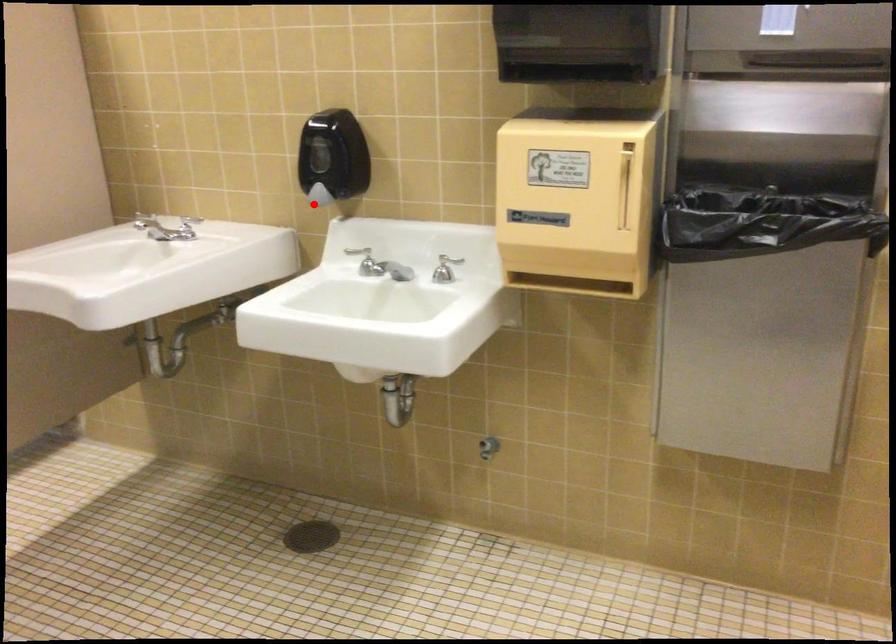
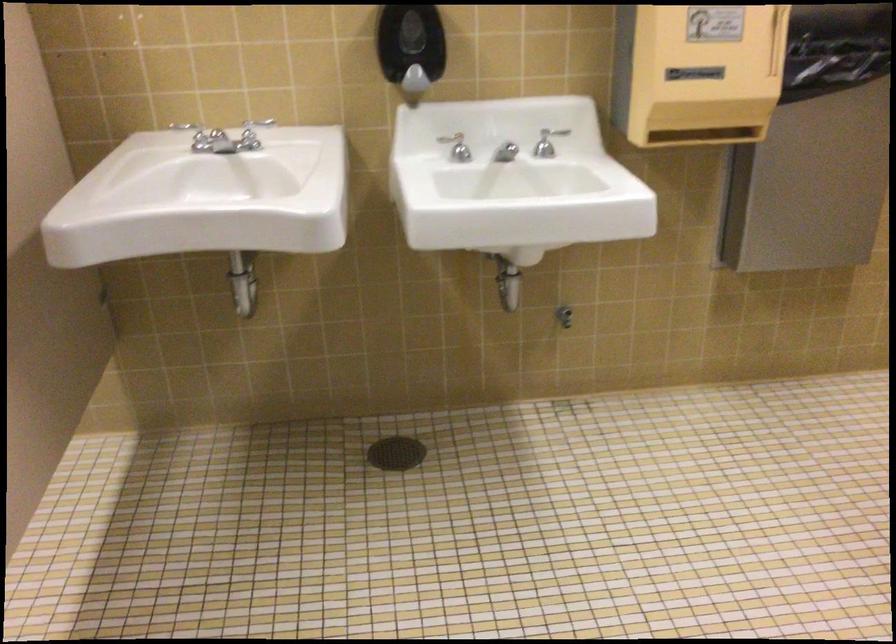
In the second image, find the point that corresponds to the highlighted location in the first image.

(412, 84)